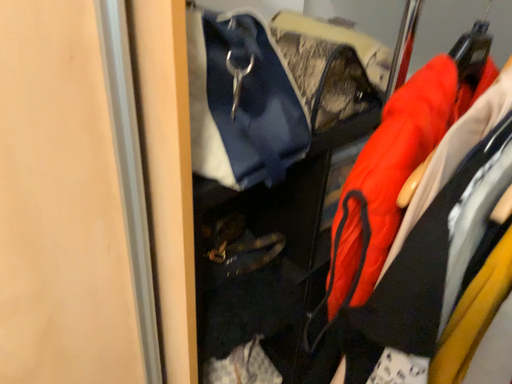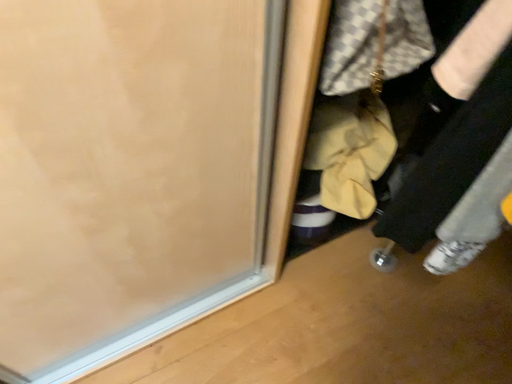
Question: Which way did the camera rotate in the video?

Choices:
 (A) rotated left
 (B) rotated right

Answer: (A)